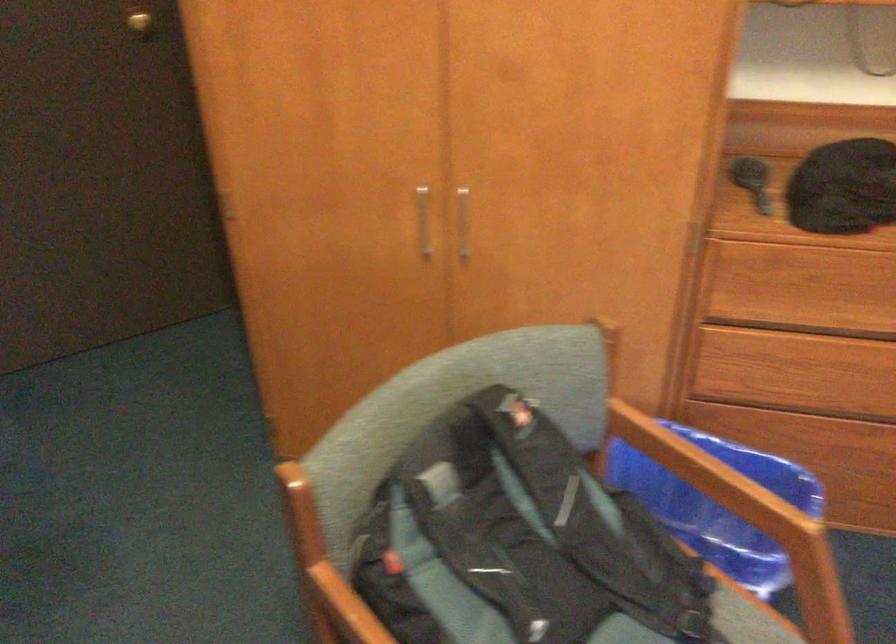
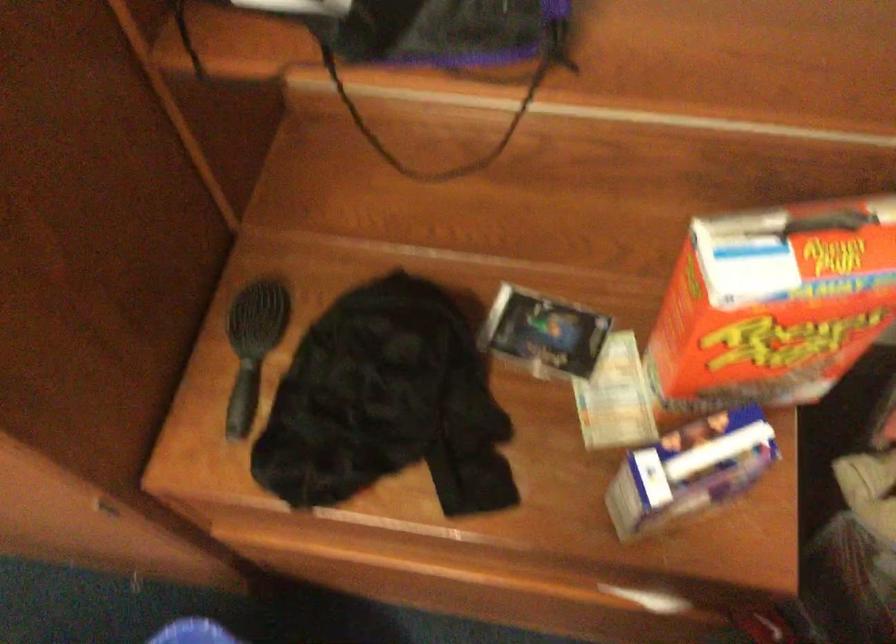
In a continuous first-person perspective shot, in which direction is the camera moving?

The movement direction of the cameraman is right, forward.